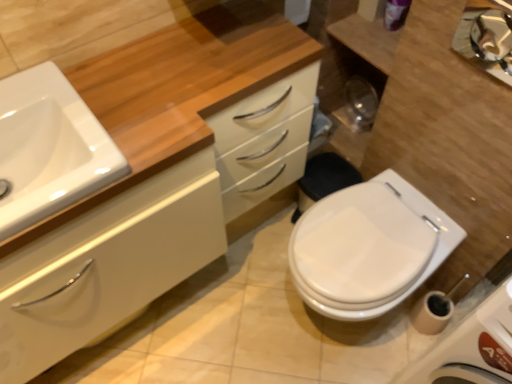
Locate an element on the screen. free point above white glossy toilet at lower right (from a real-world perspective) is located at coordinates (360, 239).